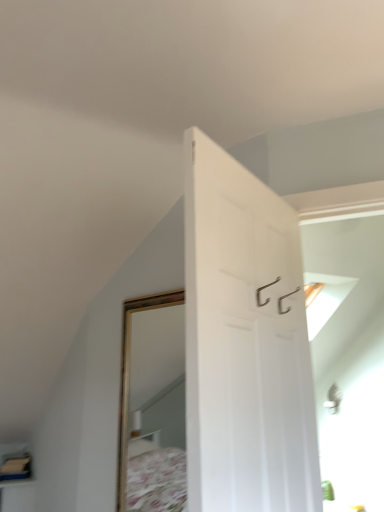
Question: Is white matte door at center bigger or smaller than wooden shelf at lower left?

Choices:
 (A) small
 (B) big

Answer: (B)

Question: In the image, is white matte door at center positioned in front of or behind wooden shelf at lower left?

Choices:
 (A) behind
 (B) front

Answer: (B)

Question: From the image's perspective, is white matte door at center located above or below wooden shelf at lower left?

Choices:
 (A) below
 (B) above

Answer: (B)

Question: Is wooden shelf at lower left inside the boundaries of white matte door at center, or outside?

Choices:
 (A) outside
 (B) inside

Answer: (A)

Question: In terms of height, does wooden shelf at lower left look taller or shorter compared to white matte door at center?

Choices:
 (A) short
 (B) tall

Answer: (A)

Question: In terms of size, does wooden shelf at lower left appear bigger or smaller than white matte door at center?

Choices:
 (A) big
 (B) small

Answer: (B)

Question: Is wooden shelf at lower left to the left or to the right of white matte door at center in the image?

Choices:
 (A) left
 (B) right

Answer: (A)